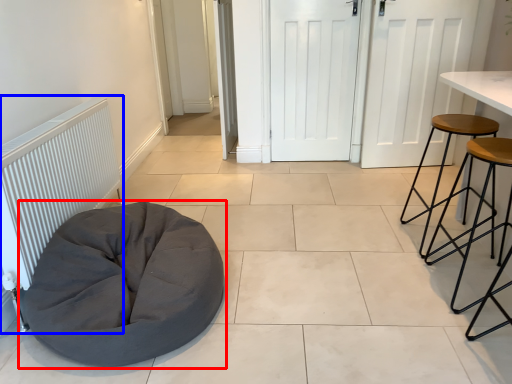
Question: Which of the following is the farthest to the observer, furniture (highlighted by a red box) or radiator (highlighted by a blue box)?

Choices:
 (A) furniture
 (B) radiator

Answer: (B)